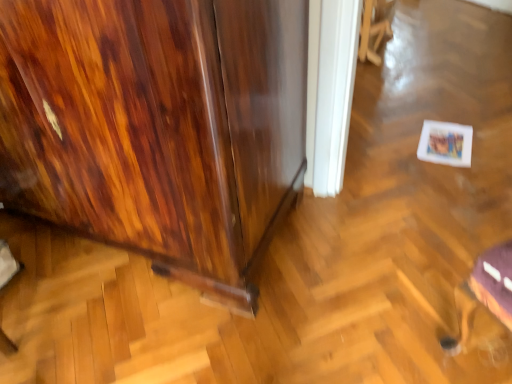
Find the location of `free space that is to the left of metallic silver swivel chair at lower right, arranged as the 2th swivel chair when viewed from the top`. free space that is to the left of metallic silver swivel chair at lower right, arranged as the 2th swivel chair when viewed from the top is located at coordinates (396, 335).